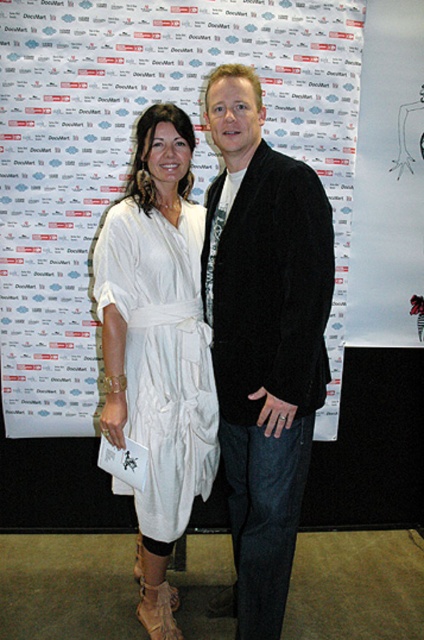
You are at a DocuMart event and need to place a new banner exactly at the center of the white paper at center. What coordinates should you use?

The coordinates for the white paper at center are at point (130, 156), so you should place the new banner at those coordinates.

You are at a DocuMart event and want to take a photo of the white cotton dress at center and the black fuzzy jacket at center. Which one should you focus on first if you want to capture both in the frame without moving the camera?

The black fuzzy jacket at center is positioned on the right side of white cotton dress at center, so you should focus on the white cotton dress at center first to ensure both are in frame without moving the camera.